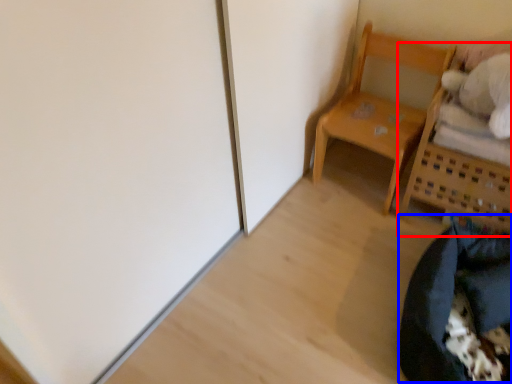
Question: Which point is further to the camera, furniture (highlighted by a red box) or bean bag chair (highlighted by a blue box)?

Choices:
 (A) furniture
 (B) bean bag chair

Answer: (A)